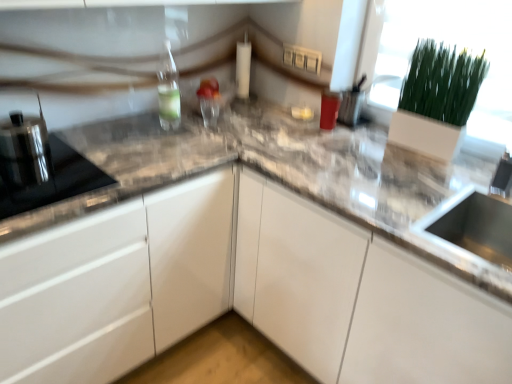
Describe the element at coordinates (351, 107) in the screenshot. I see `matte plastic container at upper right, placed as the third appliance when sorted from left to right` at that location.

Identify the location of clear glass bottle at upper left. (168, 90).

This screenshot has width=512, height=384. I want to click on black glass cooktop at left, which appears as the third appliance when viewed from the back, so click(47, 179).

Can you confirm if white glossy cabinet at center is positioned to the left of satin black kettle at left, arranged as the third appliance when viewed from the right?

No, white glossy cabinet at center is not to the left of satin black kettle at left, arranged as the third appliance when viewed from the right.

Identify the location of appliance that is the 2nd object to the left of the white glossy cabinet at center, starting at the anchor. (24, 149).

Considering the sizes of objects white glossy cabinet at center and satin black kettle at left, which is the 2th appliance from back to front, in the image provided, who is thinner, white glossy cabinet at center or satin black kettle at left, which is the 2th appliance from back to front,?

With smaller width is satin black kettle at left, which is the 2th appliance from back to front.

Is white glossy cabinet at center positioned far away from satin black kettle at left, arranged as the third appliance when viewed from the right?

No, white glossy cabinet at center is not far from satin black kettle at left, arranged as the third appliance when viewed from the right.

From the black glass cooktop at left, which ranks as the 2th appliance in right-to-left order, count 1st appliances backward and point to it. Please provide its 2D coordinates.

[(24, 149)]

Is black glass cooktop at left, which appears as the third appliance when viewed from the back, positioned before satin black kettle at left, arranged as the third appliance when viewed from the right?

Yes, black glass cooktop at left, which appears as the third appliance when viewed from the back, is closer to the viewer.

Is satin black kettle at left, arranged as the third appliance when viewed from the right, a part of black glass cooktop at left, which is the 1th appliance in front-to-back order?

No.

Based on their positions, is black glass cooktop at left, the 2th appliance in the left-to-right sequence, located to the left or right of satin black kettle at left, placed as the 2th appliance when sorted from front to back?

In the image, black glass cooktop at left, the 2th appliance in the left-to-right sequence, appears on the right side of satin black kettle at left, placed as the 2th appliance when sorted from front to back.

From the image's perspective, does white matte glass door at upper right appear higher than white glossy cabinet at center?

Yes.

Is white matte glass door at upper right smaller than white glossy cabinet at center?

Indeed, white matte glass door at upper right has a smaller size compared to white glossy cabinet at center.

You are a GUI agent. You are given a task and a screenshot of the screen. Output one action in this format:
    pyautogui.click(x=<x>, y=<y>)
    Task: Click on the glass door that is above the white glossy cabinet at center (from a real-world perspective)
    This screenshot has height=384, width=512.
    Given the screenshot: What is the action you would take?
    pyautogui.click(x=458, y=51)

Is white matte glass door at upper right to the right of white glossy cabinet at center from the viewer's perspective?

Yes.

In the scene shown: Is white matte glass door at upper right not inside satin black kettle at left, placed as the 2th appliance when sorted from front to back?

Yes, white matte glass door at upper right is not within satin black kettle at left, placed as the 2th appliance when sorted from front to back.

From the image's perspective, which is above, white matte glass door at upper right or satin black kettle at left, which is the 2th appliance from back to front?

white matte glass door at upper right is shown above in the image.

Are white matte glass door at upper right and satin black kettle at left, which is the 2th appliance from back to front, beside each other?

No, white matte glass door at upper right is not making contact with satin black kettle at left, which is the 2th appliance from back to front.

Is the position of white matte glass door at upper right less distant than that of satin black kettle at left, which is the 2th appliance from back to front?

No, white matte glass door at upper right is further to the viewer.

This screenshot has height=384, width=512. I want to click on bottle that is above the black glass cooktop at left, which is the 1th appliance in front-to-back order (from the image's perspective), so click(168, 90).

Which is more to the right, black glass cooktop at left, which appears as the third appliance when viewed from the back, or clear glass bottle at upper left?

Positioned to the right is clear glass bottle at upper left.

Is clear glass bottle at upper left completely or partially inside black glass cooktop at left, which ranks as the 2th appliance in right-to-left order?

No.

Which is behind, black glass cooktop at left, which ranks as the 2th appliance in right-to-left order, or clear glass bottle at upper left?

clear glass bottle at upper left is further from the camera.

Would you say white matte glass door at upper right is part of matte plastic container at upper right, which ranks as the third appliance in front-to-back order,'s contents?

No, white matte glass door at upper right is not a part of matte plastic container at upper right, which ranks as the third appliance in front-to-back order.

How many degrees apart are the facing directions of matte plastic container at upper right, which ranks as the third appliance in front-to-back order, and white matte glass door at upper right?

The angular difference between matte plastic container at upper right, which ranks as the third appliance in front-to-back order, and white matte glass door at upper right is 1.88 degrees.

From a real-world perspective, is matte plastic container at upper right, the 1th appliance when ordered from right to left, over white matte glass door at upper right?

No, from a real-world perspective, matte plastic container at upper right, the 1th appliance when ordered from right to left, is not above white matte glass door at upper right.

Considering the relative sizes of matte plastic container at upper right, the 1th appliance when ordered from right to left, and white matte glass door at upper right in the image provided, is matte plastic container at upper right, the 1th appliance when ordered from right to left, bigger than white matte glass door at upper right?

No.

Can you confirm if clear glass bottle at upper left is taller than satin black kettle at left, which is the 2th appliance from back to front?

Indeed, clear glass bottle at upper left has a greater height compared to satin black kettle at left, which is the 2th appliance from back to front.

Is satin black kettle at left, which is the 2th appliance from back to front, a part of clear glass bottle at upper left?

Definitely not — satin black kettle at left, which is the 2th appliance from back to front, is not inside clear glass bottle at upper left.

Between clear glass bottle at upper left and satin black kettle at left, which is the 2th appliance from back to front, which one has smaller size?

clear glass bottle at upper left.

Considering the positions of point (168, 120) and point (22, 157), is point (168, 120) closer or farther from the camera than point (22, 157)?

Point (168, 120).

Identify the location of cabinetry to the right of satin black kettle at left, arranged as the third appliance when viewed from the right. The height and width of the screenshot is (384, 512). (240, 291).

At what (x,y) coordinates should I click in order to perform the action: click on appliance that is the 1st one when counting upward from the black glass cooktop at left, the 2th appliance in the left-to-right sequence (from the image's perspective). Please return your answer as a coordinate pair (x, y). Looking at the image, I should click on (24, 149).

When comparing their distances from black glass cooktop at left, which ranks as the 2th appliance in right-to-left order, does clear glass bottle at upper left or satin black kettle at left, placed as the 2th appliance when sorted from front to back, seem closer?

Based on the image, satin black kettle at left, placed as the 2th appliance when sorted from front to back, appears to be nearer to black glass cooktop at left, which ranks as the 2th appliance in right-to-left order.

Estimate the real-world distances between objects in this image. Which object is closer to clear glass bottle at upper left, white glossy cabinet at center or white matte glass door at upper right?

white glossy cabinet at center lies closer to clear glass bottle at upper left than the other object.

Looking at the image, which one is located further to white glossy cabinet at center, clear glass bottle at upper left or white matte glass door at upper right?

white matte glass door at upper right.

Considering their positions, is clear glass bottle at upper left positioned further to white matte glass door at upper right than satin black kettle at left, placed as the 2th appliance when sorted from front to back?

satin black kettle at left, placed as the 2th appliance when sorted from front to back, lies further to white matte glass door at upper right than the other object.

Estimate the real-world distances between objects in this image. Which object is further from black glass cooktop at left, the 2th appliance in the left-to-right sequence, matte plastic container at upper right, placed as the third appliance when sorted from left to right, or white glossy cabinet at center?

Based on the image, matte plastic container at upper right, placed as the third appliance when sorted from left to right, appears to be further to black glass cooktop at left, the 2th appliance in the left-to-right sequence.

Which object lies nearer to the anchor point matte plastic container at upper right, the 1th appliance when ordered from right to left, white matte glass door at upper right or black glass cooktop at left, which appears as the third appliance when viewed from the back?

The object closer to matte plastic container at upper right, the 1th appliance when ordered from right to left, is white matte glass door at upper right.

Which object lies further to the anchor point satin black kettle at left, placed as the 2th appliance when sorted from front to back, black glass cooktop at left, which ranks as the 2th appliance in right-to-left order, or white matte glass door at upper right?

Based on the image, white matte glass door at upper right appears to be further to satin black kettle at left, placed as the 2th appliance when sorted from front to back.

Which object lies nearer to the anchor point matte plastic container at upper right, which ranks as the third appliance in front-to-back order, satin black kettle at left, arranged as the third appliance when viewed from the right, or white matte glass door at upper right?

Based on the image, white matte glass door at upper right appears to be nearer to matte plastic container at upper right, which ranks as the third appliance in front-to-back order.

Where is `bottle between black glass cooktop at left, which appears as the third appliance when viewed from the back, and matte plastic container at upper right, the first appliance in the back-to-front sequence, from left to right`? The height and width of the screenshot is (384, 512). bottle between black glass cooktop at left, which appears as the third appliance when viewed from the back, and matte plastic container at upper right, the first appliance in the back-to-front sequence, from left to right is located at coordinates (168, 90).

At what (x,y) coordinates should I click in order to perform the action: click on appliance between white glossy cabinet at center and white matte glass door at upper right. Please return your answer as a coordinate pair (x, y). The width and height of the screenshot is (512, 384). Looking at the image, I should click on (351, 107).

Where is `bottle between satin black kettle at left, placed as the 2th appliance when sorted from front to back, and matte plastic container at upper right, the 1th appliance when ordered from right to left`? bottle between satin black kettle at left, placed as the 2th appliance when sorted from front to back, and matte plastic container at upper right, the 1th appliance when ordered from right to left is located at coordinates (168, 90).

Identify the location of cabinetry between satin black kettle at left, arranged as the third appliance when viewed from the right, and matte plastic container at upper right, the first appliance in the back-to-front sequence. The height and width of the screenshot is (384, 512). (240, 291).